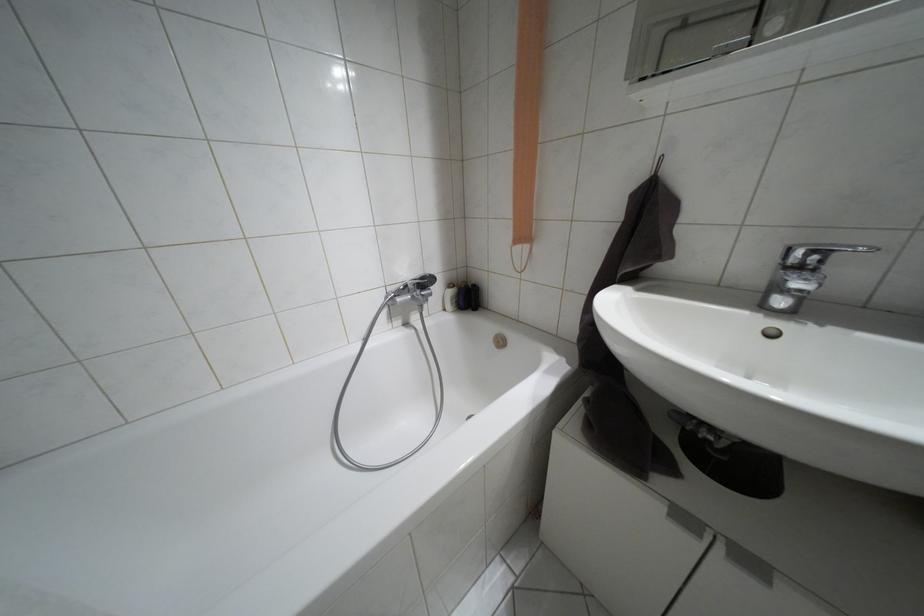
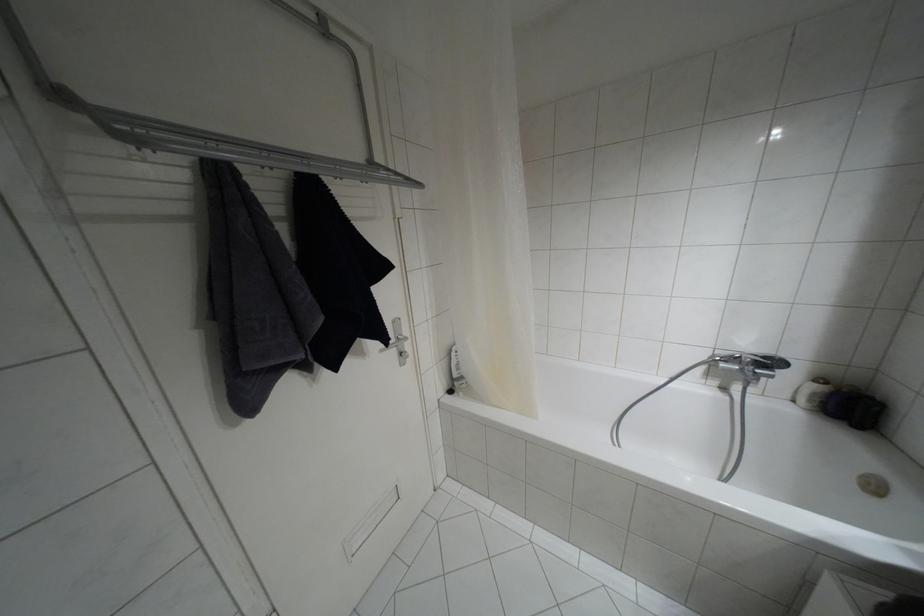
Locate, in the second image, the point that corresponds to point (420, 277) in the first image.

(763, 357)